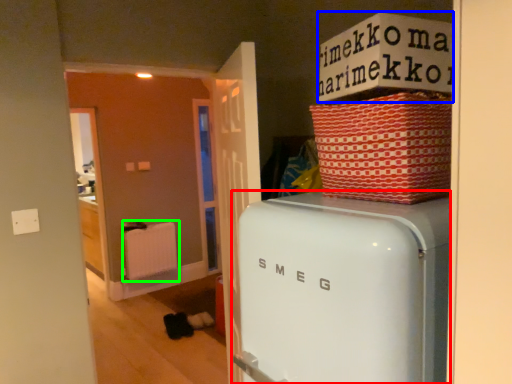
Question: Considering the real-world distances, which object is farthest from home appliance (highlighted by a red box)? cardboard box (highlighted by a blue box) or radiator (highlighted by a green box)?

Choices:
 (A) cardboard box
 (B) radiator

Answer: (B)